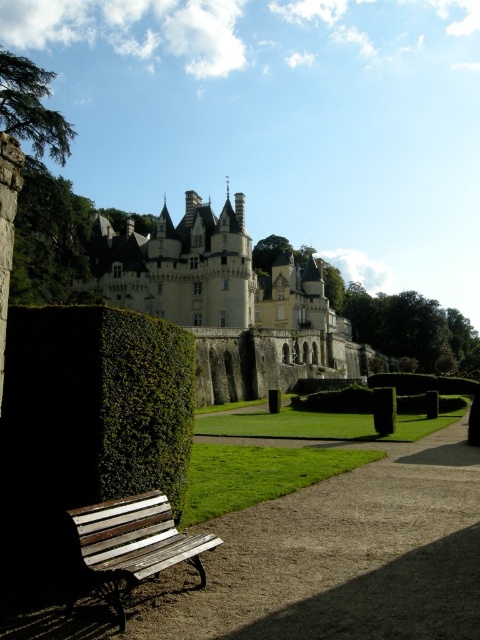
You are a tourist standing at the wooden bench at lower left and want to reach the green leafy hedge at lower center. Given that you can walk at a speed of 1.5 meters per second, how long will it take you to reach the hedge?

The distance between the wooden bench at lower left and the green leafy hedge at lower center is 41.28 meters. At a walking speed of 1.5 meters per second, the time required would be 41.28 divided by 1.5, which equals approximately 27.52 seconds. Therefore, it will take roughly 28 seconds to reach the hedge.

You are standing at the entrance of the castle and want to sit on the wooden bench. Which direction should you walk to reach the bench while staying on the brown gravel path at lower center and keeping the dark green hedge at lower left on your left side?

Walk forward while staying on the brown gravel path at lower center and keeping the dark green hedge at lower left on your left side, as the path is to the right of the hedge.